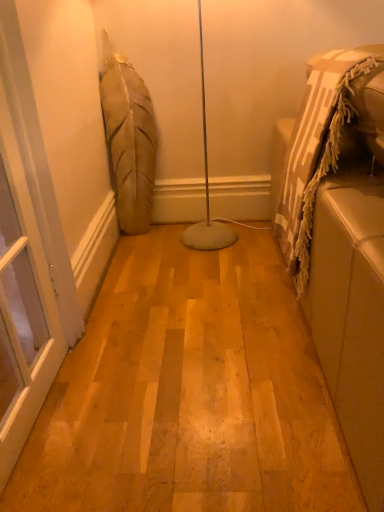
Question: From the image's perspective, is transparent glass screen door at left positioned above or below beige fabric couch at right?

Choices:
 (A) above
 (B) below

Answer: (B)

Question: In terms of width, does transparent glass screen door at left look wider or thinner when compared to beige fabric couch at right?

Choices:
 (A) wide
 (B) thin

Answer: (B)

Question: From a real-world perspective, is transparent glass screen door at left positioned above or below beige fabric couch at right?

Choices:
 (A) above
 (B) below

Answer: (A)

Question: Is point pos(339,284) closer or farther from the camera than point pos(34,228)?

Choices:
 (A) farther
 (B) closer

Answer: (B)

Question: Considering the positions of beige fabric couch at right and transparent glass screen door at left in the image, is beige fabric couch at right wider or thinner than transparent glass screen door at left?

Choices:
 (A) wide
 (B) thin

Answer: (A)

Question: Looking at the image, does beige fabric couch at right seem bigger or smaller compared to transparent glass screen door at left?

Choices:
 (A) small
 (B) big

Answer: (B)

Question: From their relative heights in the image, would you say beige fabric couch at right is taller or shorter than transparent glass screen door at left?

Choices:
 (A) short
 (B) tall

Answer: (A)